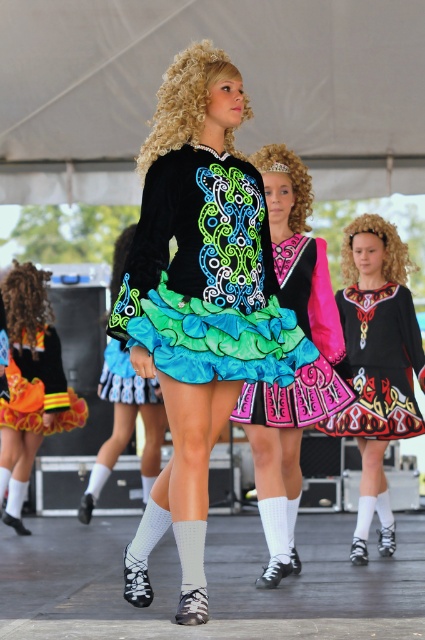
Is matte black dress with colorful ruffles at center to the left of orange-yellow sequined skirt at lower left from the viewer's perspective?

No, matte black dress with colorful ruffles at center is not to the left of orange-yellow sequined skirt at lower left.

Is point (136, 266) behind point (65, 429)?

That is False.

Locate an element on the screen. The image size is (425, 640). matte black dress with colorful ruffles at center is located at coordinates (206, 275).

I want to click on matte black dress with colorful ruffles at center, so click(x=206, y=275).

Can you confirm if matte black dress with colorful ruffles at center is smaller than black velvet dress at center?

Yes.

Can you confirm if matte black dress with colorful ruffles at center is positioned below black velvet dress at center?

No.

Between point (212, 156) and point (405, 392), which one is positioned in front?

Point (212, 156) is in front.

This screenshot has height=640, width=425. I want to click on matte black dress with colorful ruffles at center, so click(x=206, y=275).

Consider the image. Does black embroidered dress at center have a lesser width compared to orange-yellow sequined skirt at lower left?

In fact, black embroidered dress at center might be wider than orange-yellow sequined skirt at lower left.

Identify the location of black embroidered dress at center. (379, 364).